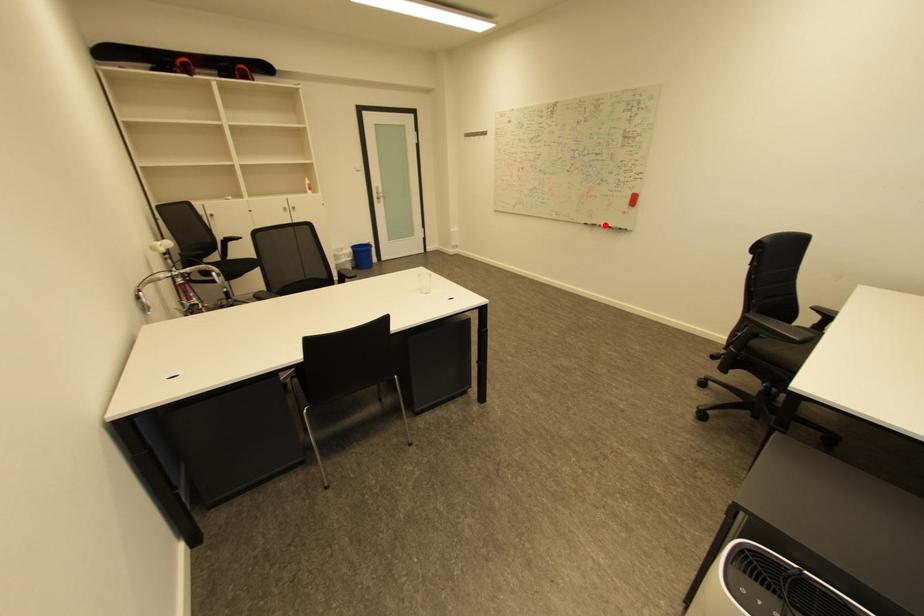
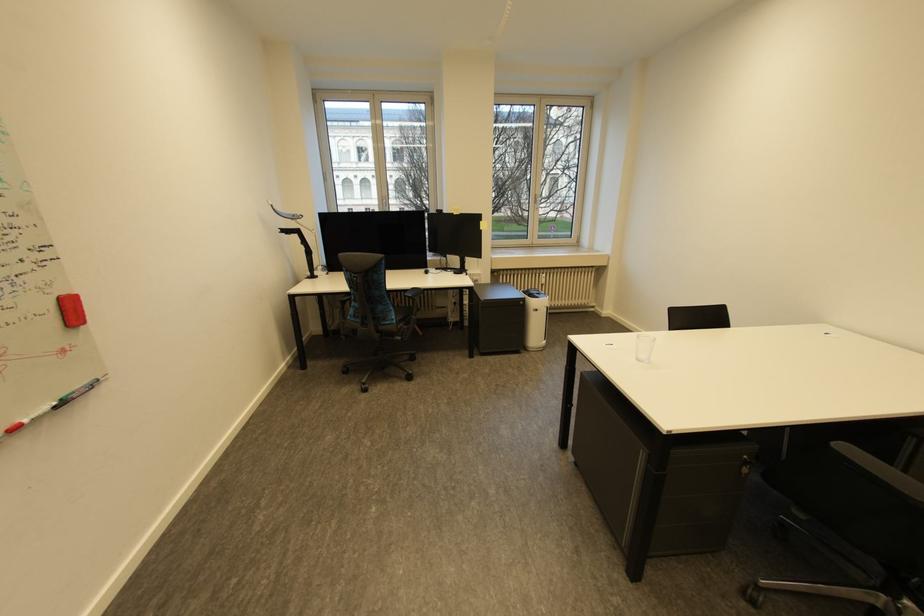
The point at the highlighted location is marked in the first image. Where is the corresponding point in the second image?

(6, 436)